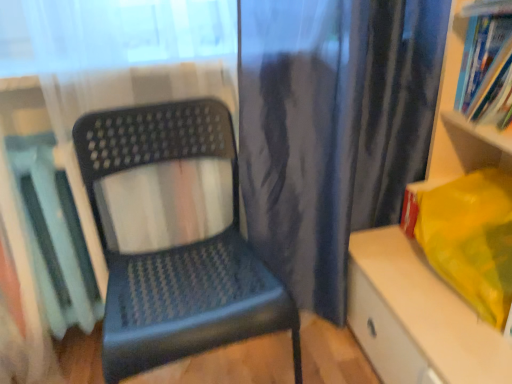
Question: Does matte plastic books at upper right, the first shelf in the top-to-bottom sequence, lie behind matte plastic shelf at right, the 1th shelf from the bottom?

Choices:
 (A) yes
 (B) no

Answer: (A)

Question: Is matte plastic books at upper right, the first shelf in the top-to-bottom sequence, aimed at matte plastic shelf at right, the 1th shelf from the bottom?

Choices:
 (A) yes
 (B) no

Answer: (A)

Question: Is matte plastic books at upper right, the second shelf positioned from the bottom, surrounding matte plastic shelf at right, arranged as the second shelf when viewed from the top?

Choices:
 (A) no
 (B) yes

Answer: (A)

Question: Considering the relative sizes of matte plastic books at upper right, the first shelf in the top-to-bottom sequence, and matte plastic shelf at right, arranged as the second shelf when viewed from the top, in the image provided, is matte plastic books at upper right, the first shelf in the top-to-bottom sequence, shorter than matte plastic shelf at right, arranged as the second shelf when viewed from the top,?

Choices:
 (A) no
 (B) yes

Answer: (B)

Question: Is matte plastic books at upper right, the first shelf in the top-to-bottom sequence, oriented away from matte plastic shelf at right, the 1th shelf from the bottom?

Choices:
 (A) no
 (B) yes

Answer: (B)

Question: Is matte plastic books at upper right, the first shelf in the top-to-bottom sequence, touching matte plastic shelf at right, arranged as the second shelf when viewed from the top?

Choices:
 (A) yes
 (B) no

Answer: (B)

Question: Is matte plastic book at left, positioned as the 2th book in right-to-left order, behind matte plastic chair at center?

Choices:
 (A) yes
 (B) no

Answer: (A)

Question: Can you confirm if matte plastic book at left, which is the second book in top-to-bottom order, is positioned to the right of matte plastic chair at center?

Choices:
 (A) no
 (B) yes

Answer: (A)

Question: Does matte plastic book at left, which is the second book in top-to-bottom order, lie in front of matte plastic chair at center?

Choices:
 (A) yes
 (B) no

Answer: (B)

Question: Does matte plastic book at left, positioned as the 2th book in right-to-left order, have a larger size compared to matte plastic chair at center?

Choices:
 (A) yes
 (B) no

Answer: (B)

Question: From a real-world perspective, does matte plastic book at left, positioned as the 1th book in left-to-right order, sit lower than matte plastic chair at center?

Choices:
 (A) no
 (B) yes

Answer: (A)

Question: Is matte plastic book at left, the 1th book positioned from the bottom, positioned beyond the bounds of matte plastic chair at center?

Choices:
 (A) no
 (B) yes

Answer: (B)

Question: Is matte plastic chair at center positioned behind blue paperback book at upper right, which is counted as the 1th book, starting from the right?

Choices:
 (A) no
 (B) yes

Answer: (A)